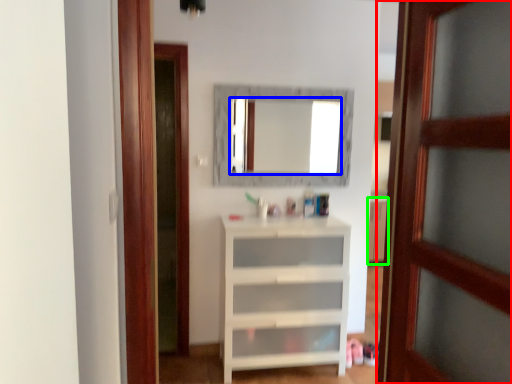
Question: Which is farther away from door (highlighted by a red box)? mirror (highlighted by a blue box) or cabinetry (highlighted by a green box)?

Choices:
 (A) mirror
 (B) cabinetry

Answer: (A)